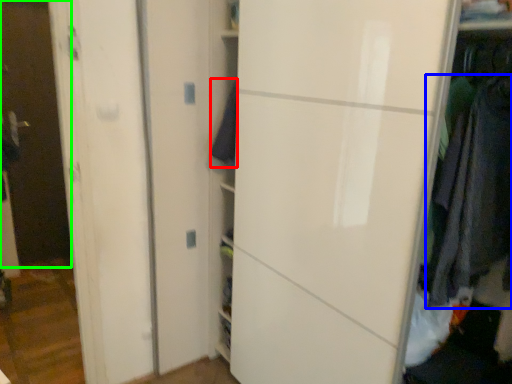
Question: Considering the real-world distances, which object is farthest from clothing (highlighted by a red box)? clothing (highlighted by a blue box) or glass door (highlighted by a green box)?

Choices:
 (A) clothing
 (B) glass door

Answer: (B)